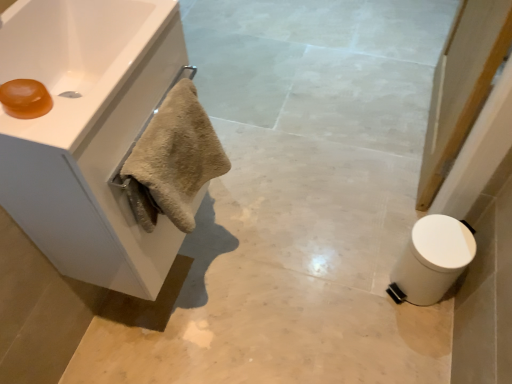
Identify the location of blank space situated above white matte trash can at lower right (from a real-world perspective). The width and height of the screenshot is (512, 384). [x=439, y=242].